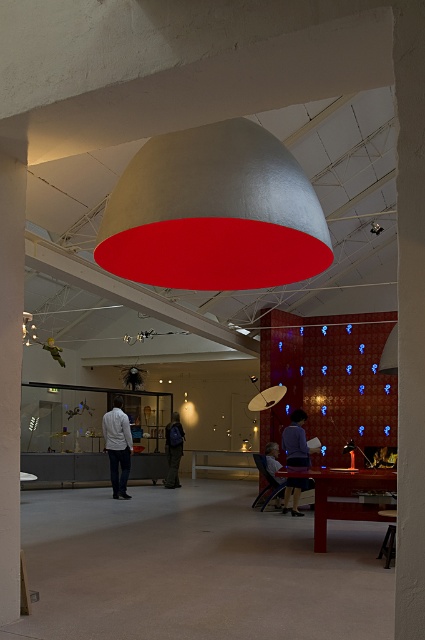
You are standing at the entrance of the gallery and see the blue fabric shirt at center. If you want to walk directly to it, how many steps would you need to take if each step covers about 3 feet?

The blue fabric shirt at center is 29.21 feet away. Since each step covers about 3 feet, you would need approximately 10 steps to reach it.